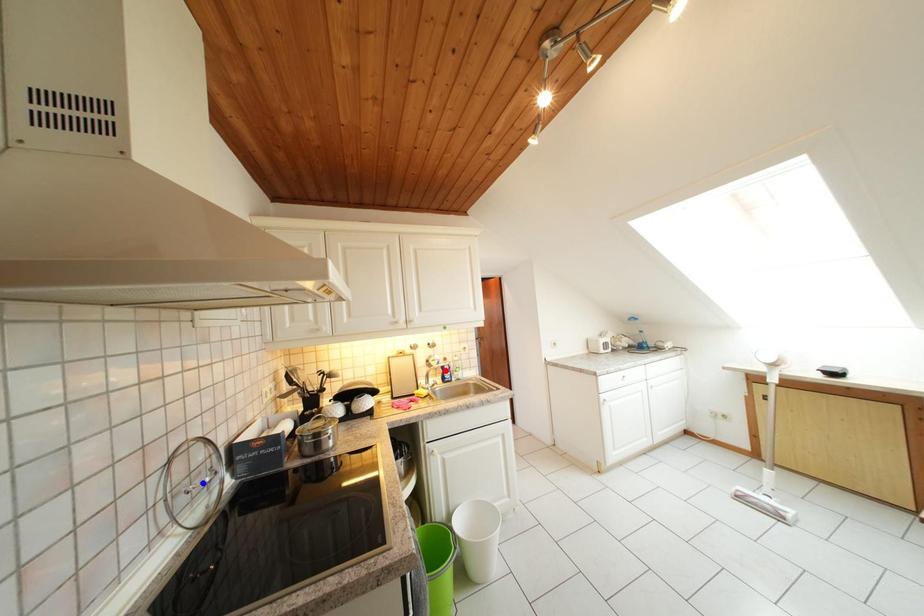
Question: Which of the two points in the image is closer to the camera?

Choices:
 (A) Blue point is closer.
 (B) Red point is closer.

Answer: (A)